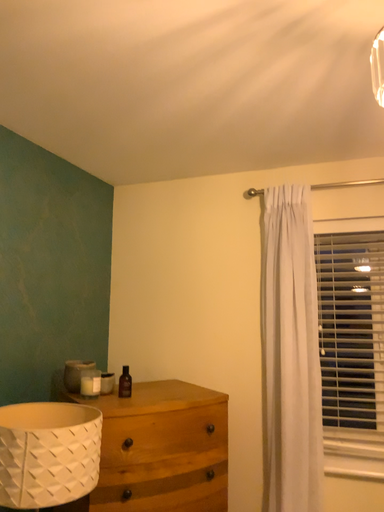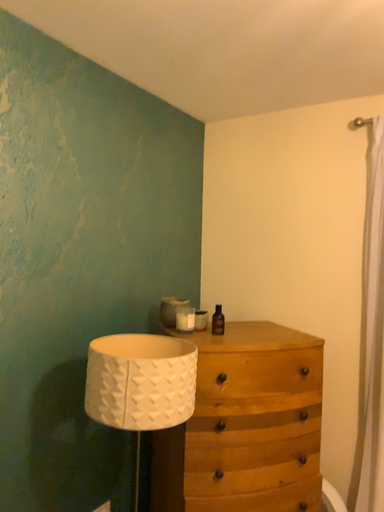
Question: Which way did the camera rotate in the video?

Choices:
 (A) rotated upward
 (B) rotated downward

Answer: (B)